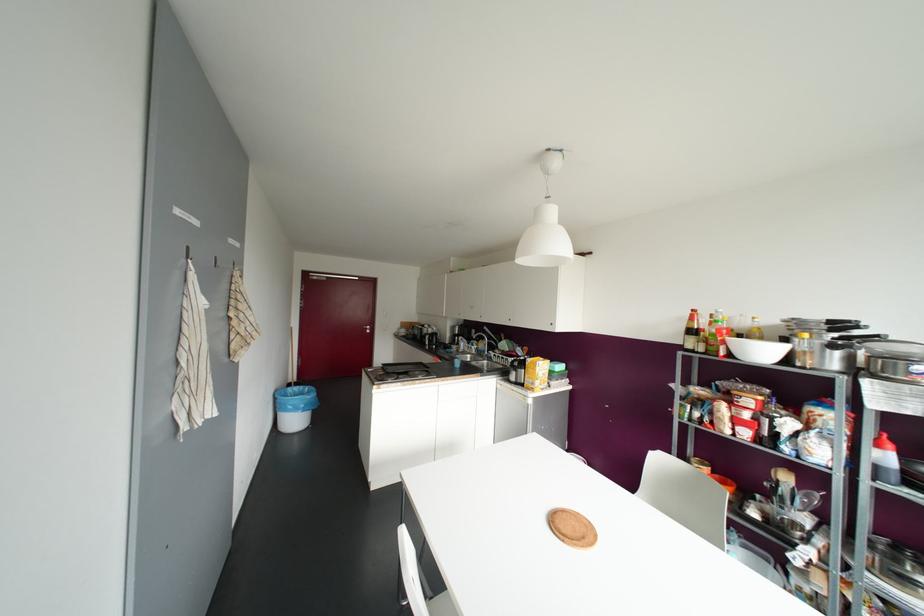
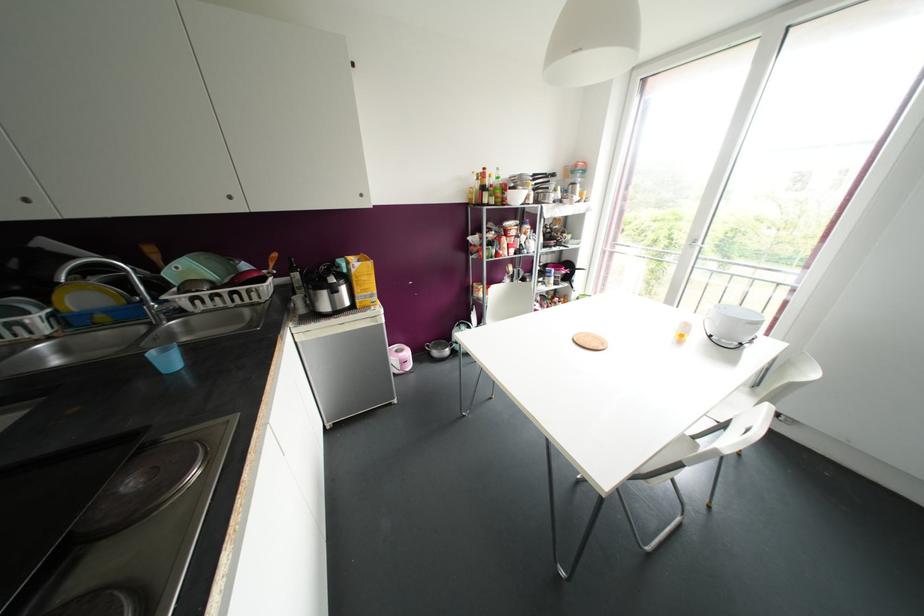
Find the pixel in the second image that matches point 456,363 in the first image.

(168, 361)